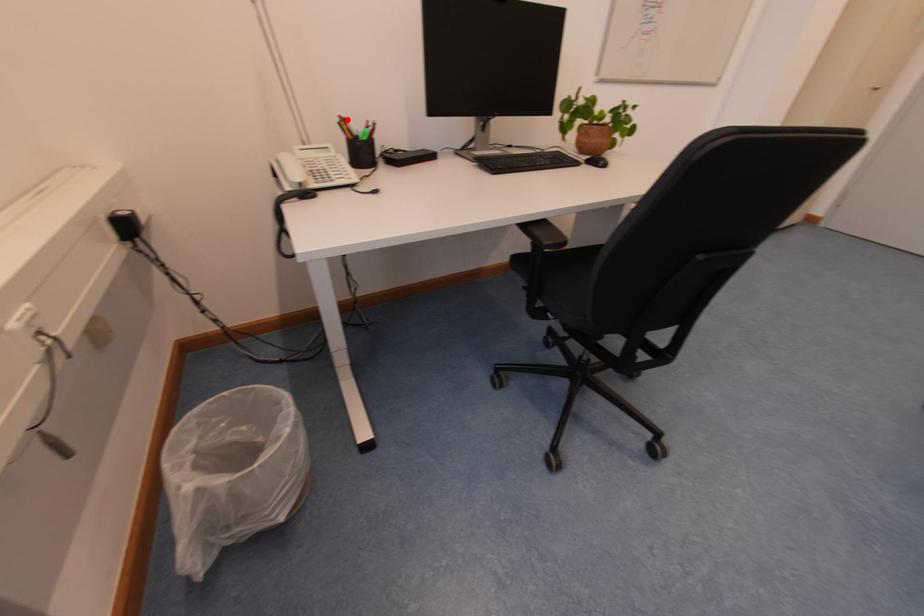
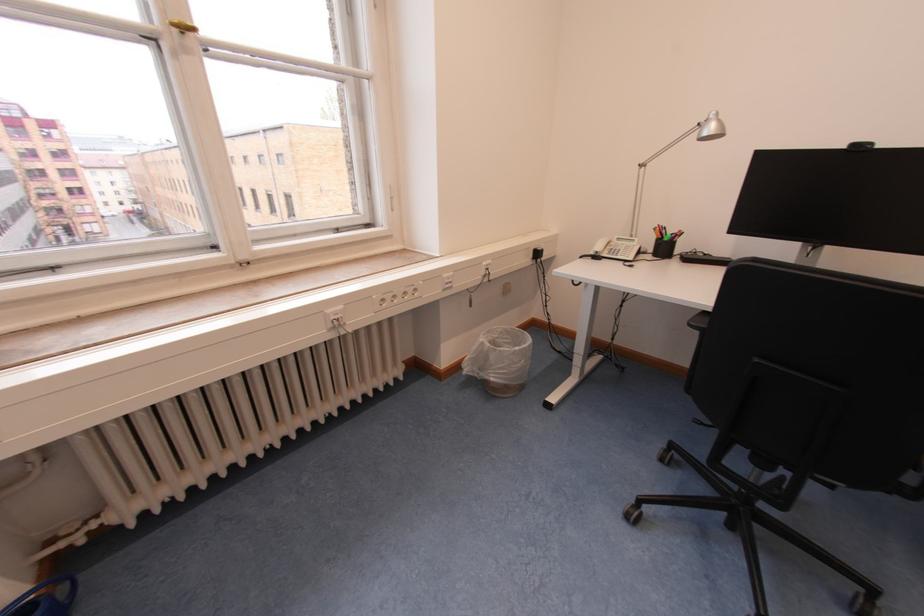
Question: I am providing you with two images of the same scene from different viewpoints. A red point is marked on the first image. Is the red point's position out of view in image 2?

Choices:
 (A) Yes
 (B) No

Answer: (B)